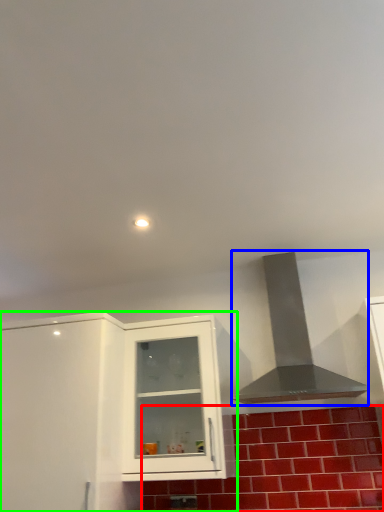
Question: Estimate the real-world distances between objects in this image. Which object is closer to brick (highlighted by a red box), vent (highlighted by a blue box) or cabinetry (highlighted by a green box)?

Choices:
 (A) vent
 (B) cabinetry

Answer: (A)